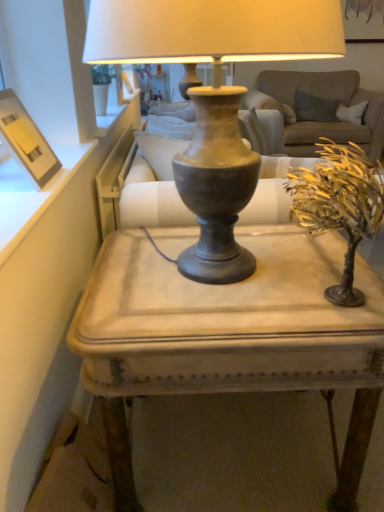
Question: Can you confirm if matte gray table at center is thinner than matte wood picture frame at upper left?

Choices:
 (A) yes
 (B) no

Answer: (B)

Question: Is matte gray table at center far away from matte wood picture frame at upper left?

Choices:
 (A) yes
 (B) no

Answer: (B)

Question: From a real-world perspective, is matte gray table at center under matte wood picture frame at upper left?

Choices:
 (A) no
 (B) yes

Answer: (B)

Question: Could you tell me if matte gray table at center is turned towards matte wood picture frame at upper left?

Choices:
 (A) yes
 (B) no

Answer: (B)

Question: Is matte gray table at center next to matte wood picture frame at upper left?

Choices:
 (A) no
 (B) yes

Answer: (A)

Question: Does matte gray table at center have a smaller size compared to matte wood picture frame at upper left?

Choices:
 (A) no
 (B) yes

Answer: (A)

Question: Does matte wood picture frame at upper left have a lesser height compared to matte gray table at center?

Choices:
 (A) yes
 (B) no

Answer: (A)

Question: Is matte wood picture frame at upper left further to camera compared to matte gray table at center?

Choices:
 (A) yes
 (B) no

Answer: (A)

Question: From a real-world perspective, is matte wood picture frame at upper left located beneath matte gray table at center?

Choices:
 (A) yes
 (B) no

Answer: (B)

Question: From a real-world perspective, is matte wood picture frame at upper left positioned over matte gray table at center based on gravity?

Choices:
 (A) no
 (B) yes

Answer: (B)

Question: Considering the relative sizes of matte wood picture frame at upper left and matte gray table at center in the image provided, is matte wood picture frame at upper left wider than matte gray table at center?

Choices:
 (A) yes
 (B) no

Answer: (B)

Question: Does matte wood picture frame at upper left turn towards matte gray table at center?

Choices:
 (A) no
 (B) yes

Answer: (A)

Question: Is matte wood picture frame at upper left surrounded by gold textured tree at right?

Choices:
 (A) yes
 (B) no

Answer: (B)